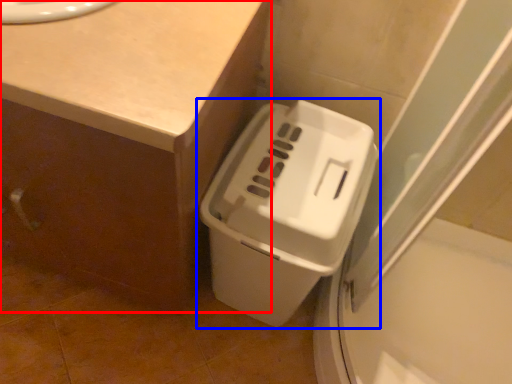
Question: Among these objects, which one is nearest to the camera, counter (highlighted by a red box) or waste container (highlighted by a blue box)?

Choices:
 (A) counter
 (B) waste container

Answer: (A)